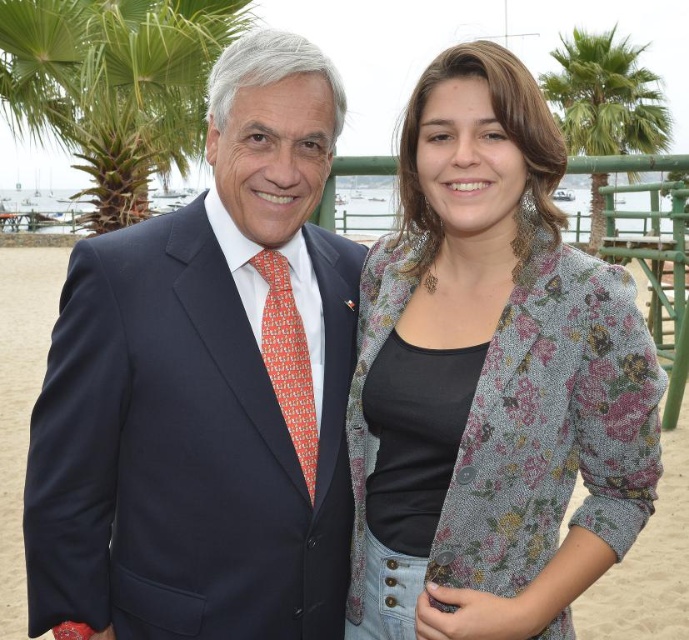
Is green leafy palm tree at upper right taller than orange printed tie at center?

Indeed, green leafy palm tree at upper right has a greater height compared to orange printed tie at center.

Which is behind, point (597, 88) or point (276, 372)?

The point (597, 88) is more distant.

Who is more forward, [619,104] or [291,413]?

Point [291,413] is more forward.

Locate an element on the screen. The height and width of the screenshot is (640, 689). green leafy palm tree at upper right is located at coordinates (606, 97).

Can you confirm if floral-patterned jacket at center is shorter than green leafy palm tree at upper left?

Indeed, floral-patterned jacket at center has a lesser height compared to green leafy palm tree at upper left.

Can you confirm if floral-patterned jacket at center is smaller than green leafy palm tree at upper left?

Yes, floral-patterned jacket at center is smaller than green leafy palm tree at upper left.

Is point (398, 362) in front of point (145, 17)?

That is True.

You are a GUI agent. You are given a task and a screenshot of the screen. Output one action in this format:
    pyautogui.click(x=<x>, y=<y>)
    Task: Click on the floral-patterned jacket at center
    
    Given the screenshot: What is the action you would take?
    pyautogui.click(x=491, y=378)

Can you confirm if floral-patterned jacket at center is bigger than orange printed tie at center?

Correct, floral-patterned jacket at center is larger in size than orange printed tie at center.

Which is more to the right, floral-patterned jacket at center or orange printed tie at center?

Positioned to the right is floral-patterned jacket at center.

Who is more distant from viewer, (628, 506) or (309, 476)?

The point (309, 476) is more distant.

Where is `floral-patterned jacket at center`? floral-patterned jacket at center is located at coordinates (491, 378).